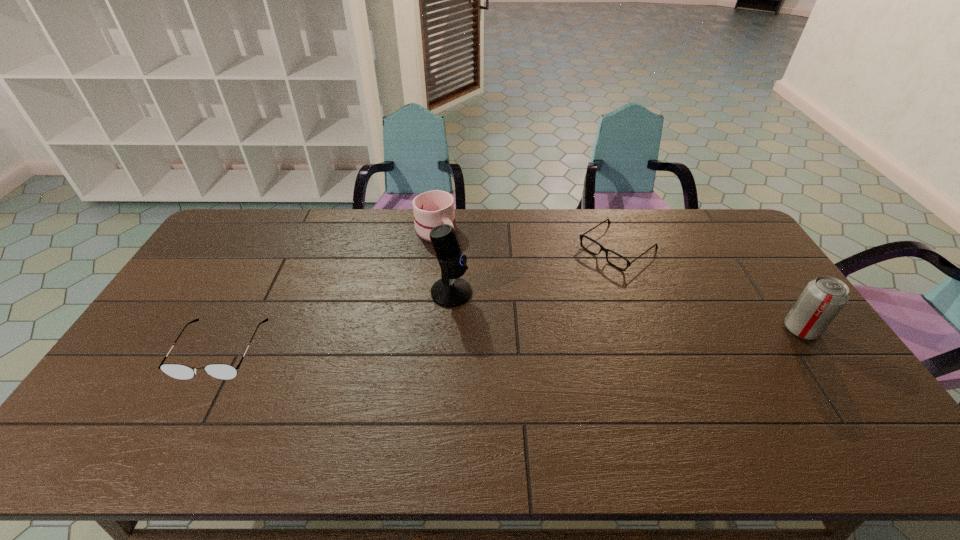
At what (x,y) coordinates should I click in order to perform the action: click on free space on the desktop that is between the left spectacles and the second tallest object and is positioned on the stand of the third nearest object. Please return your answer as a coordinate pair (x, y). This screenshot has height=540, width=960. Looking at the image, I should click on (560, 338).

Locate an element on the screen. The height and width of the screenshot is (540, 960). free space on the desktop that is between the nearer spectacles and the rightmost object and is positioned on the front-facing side of the right spectacles is located at coordinates (492, 341).

Locate an element on the screen. vacant spot on the desktop that is between the nearer spectacles and the rightmost object and is positioned on the side with the handle of the mug is located at coordinates (523, 339).